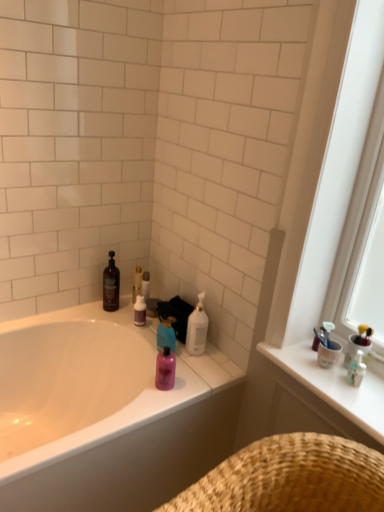
Where is `vacant area to the right of blue glossy bottle at center, arranged as the 2th cleaning product when viewed from the right`? vacant area to the right of blue glossy bottle at center, arranged as the 2th cleaning product when viewed from the right is located at coordinates 203,364.